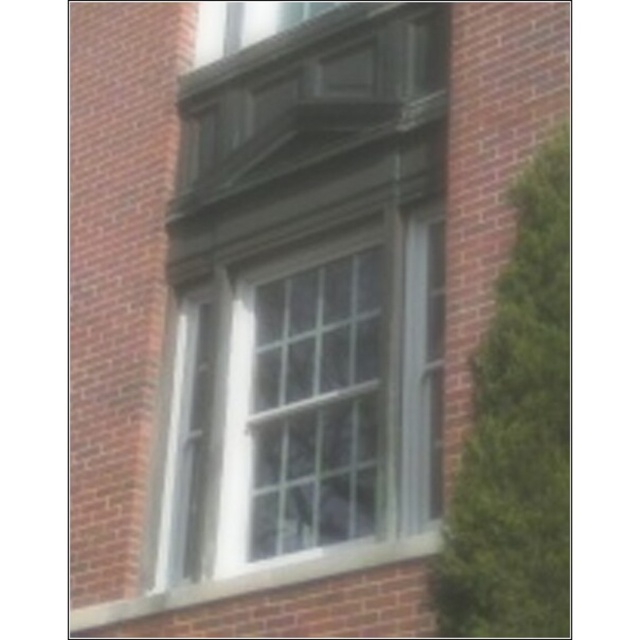
Question: Which point appears closest to the camera in this image?

Choices:
 (A) (253, 576)
 (B) (440, 266)

Answer: (A)

Question: Which object appears closest to the camera in this image?

Choices:
 (A) white glass window at center
 (B) white painted wood at lower center

Answer: (B)

Question: Is white glass window at center in front of white painted wood at lower center?

Choices:
 (A) no
 (B) yes

Answer: (A)

Question: Considering the relative positions of white glass window at center and white painted wood at lower center in the image provided, where is white glass window at center located with respect to white painted wood at lower center?

Choices:
 (A) above
 (B) below

Answer: (A)

Question: Can you confirm if white glass window at center is positioned to the left of white painted wood at lower center?

Choices:
 (A) no
 (B) yes

Answer: (A)